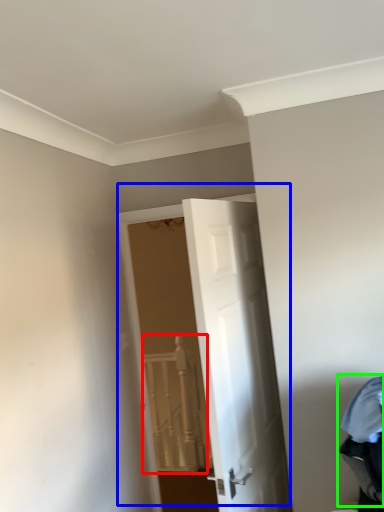
Question: Which object is the closest to the rail (highlighted by a red box)? Choose among these: door (highlighted by a blue box) or laundry (highlighted by a green box).

Choices:
 (A) door
 (B) laundry

Answer: (A)